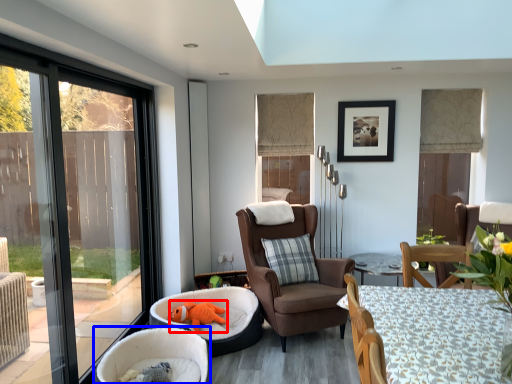
Question: Which of the following is the closest to the observer, animal (highlighted by a red box) or chair (highlighted by a blue box)?

Choices:
 (A) animal
 (B) chair

Answer: (B)